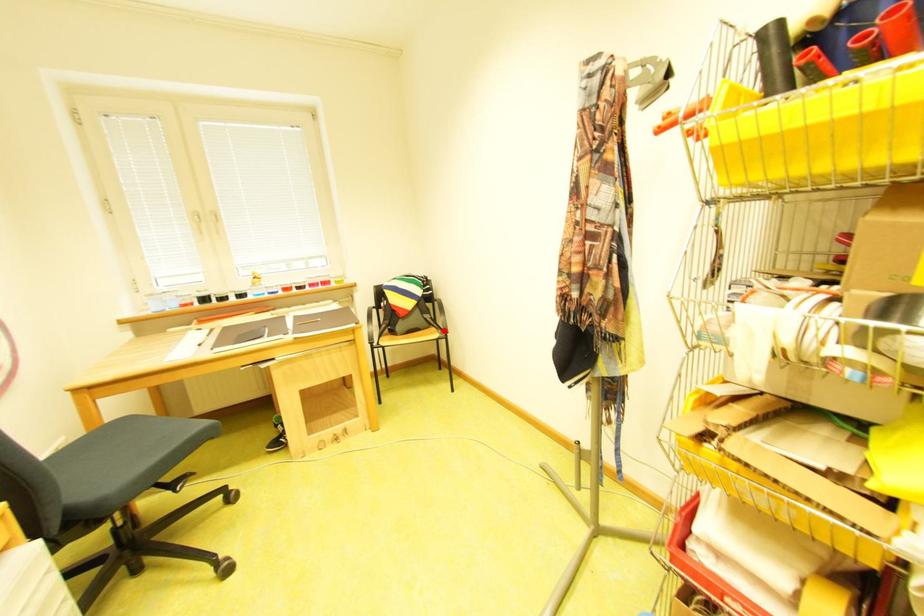
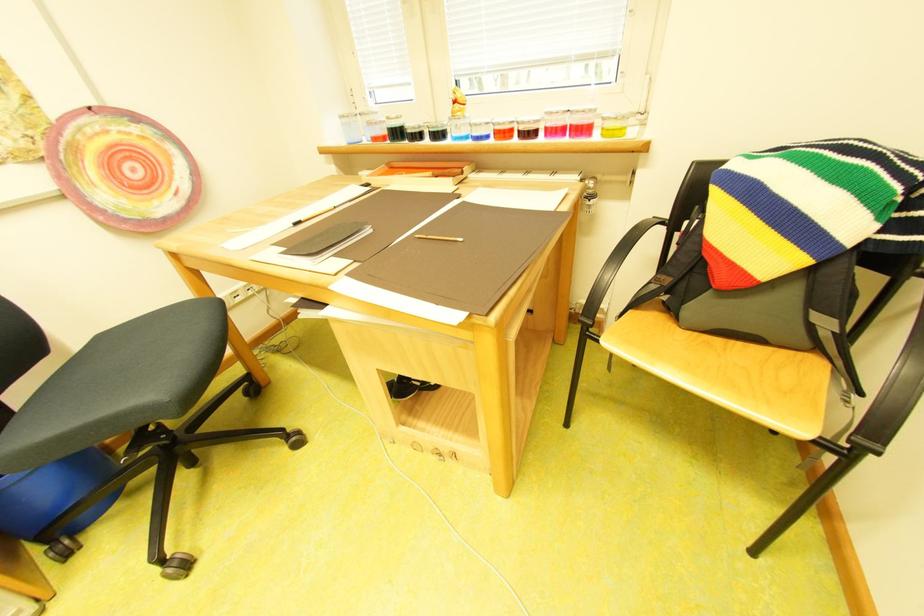
Where in the second image is the point corresponding to the highlighted location from the first image?

(829, 367)